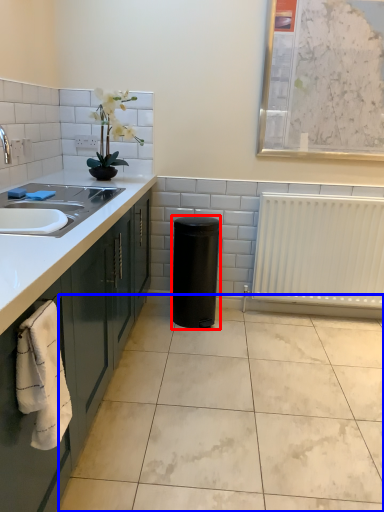
Question: Which object is further to the camera taking this photo, appliance (highlighted by a red box) or ceramic tile (highlighted by a blue box)?

Choices:
 (A) appliance
 (B) ceramic tile

Answer: (A)